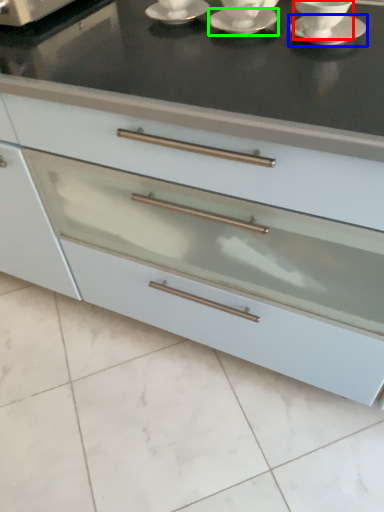
Question: Which object is positioned closest to tableware (highlighted by a red box)? Select from saucer (highlighted by a blue box) and saucer (highlighted by a green box).

Choices:
 (A) saucer
 (B) saucer

Answer: (A)